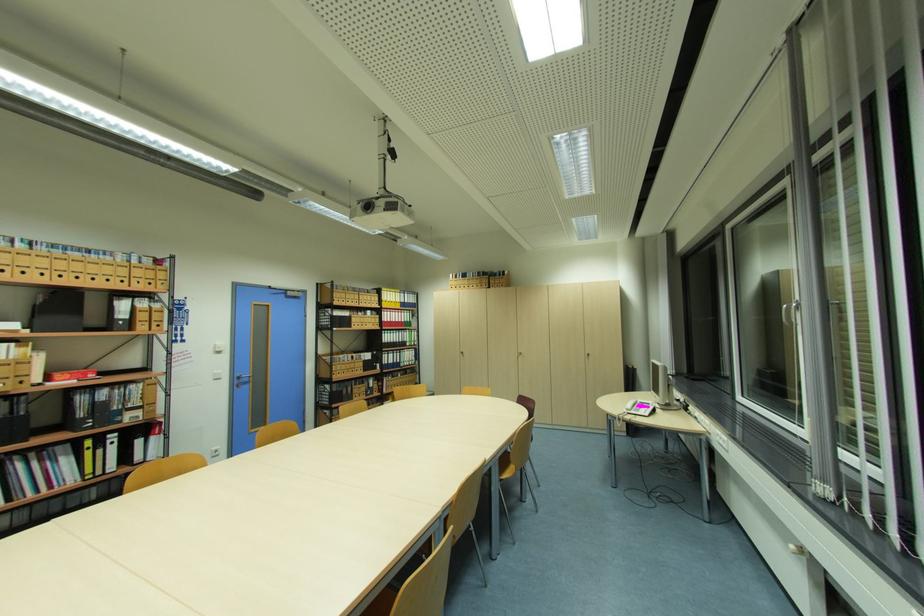
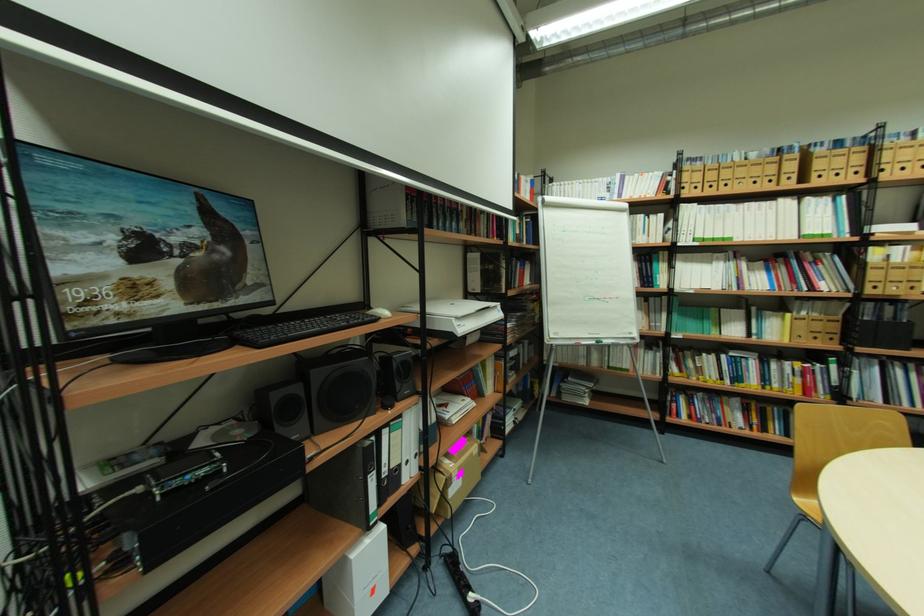
Question: How did the camera likely rotate?

Choices:
 (A) Left
 (B) Right
 (C) Up
 (D) Down

Answer: (A)